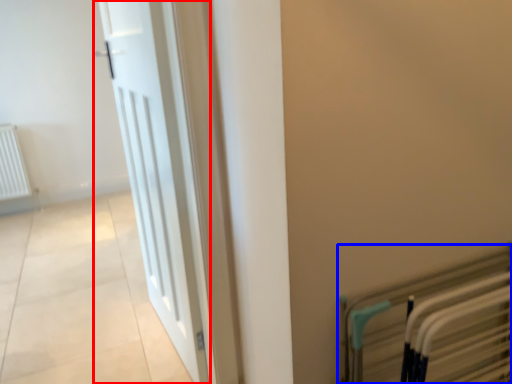
Question: Which object appears closest to the camera in this image, door (highlighted by a red box) or bed frame (highlighted by a blue box)?

Choices:
 (A) door
 (B) bed frame

Answer: (B)